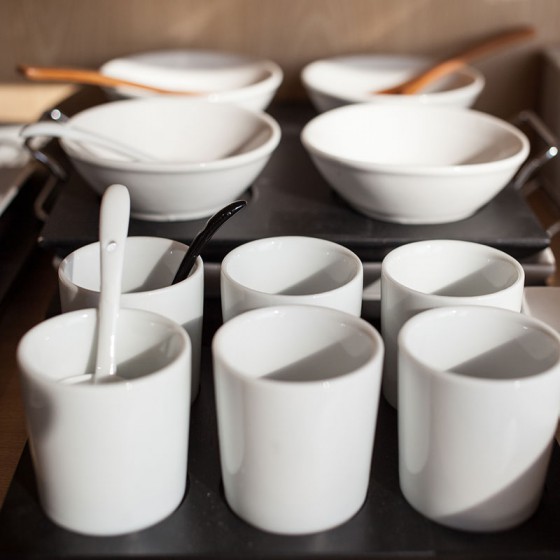
You are a GUI agent. You are given a task and a screenshot of the screen. Output one action in this format:
    pyautogui.click(x=<x>, y=<y>)
    Task: Click on the bowl
    This screenshot has width=560, height=560.
    Given the screenshot: What is the action you would take?
    pyautogui.click(x=216, y=168), pyautogui.click(x=244, y=86), pyautogui.click(x=338, y=132), pyautogui.click(x=350, y=91)